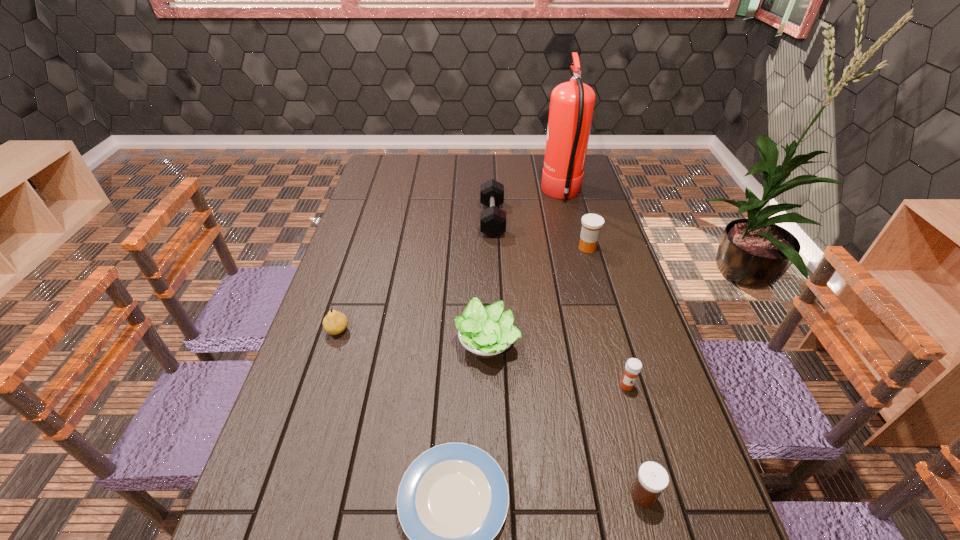
Find the location of a particular element. This screenshot has height=540, width=960. object located at the left edge is located at coordinates (334, 323).

The height and width of the screenshot is (540, 960). Find the location of `fire extinguisher present at the right edge`. fire extinguisher present at the right edge is located at coordinates (572, 103).

Where is `object at the far right corner`? object at the far right corner is located at coordinates (572, 103).

The width and height of the screenshot is (960, 540). I want to click on free region at the left edge, so click(x=356, y=312).

In the image, there is a desktop. Where is `vacant space at the right edge`? The height and width of the screenshot is (540, 960). vacant space at the right edge is located at coordinates (672, 482).

At what (x,y) coordinates should I click in order to perform the action: click on free space that is in between the dumbbell and the fire extinguisher. Please return your answer as a coordinate pair (x, y). Looking at the image, I should click on (527, 207).

This screenshot has height=540, width=960. In order to click on vacant area between the third nearest object and the dumbbell in this screenshot , I will do `click(560, 302)`.

This screenshot has height=540, width=960. In order to click on vacant space in between the lettuce and the fire extinguisher in this screenshot , I will do `click(524, 269)`.

Image resolution: width=960 pixels, height=540 pixels. Find the location of `free space between the fire extinguisher and the nearest medicine`. free space between the fire extinguisher and the nearest medicine is located at coordinates (603, 345).

Where is `free area in between the dumbbell and the lettuce`? Image resolution: width=960 pixels, height=540 pixels. free area in between the dumbbell and the lettuce is located at coordinates (490, 281).